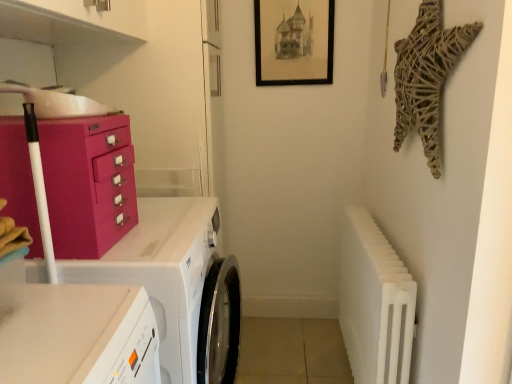
Where is `unoccupied region to the right of matte pink cabinet at left`? Image resolution: width=512 pixels, height=384 pixels. unoccupied region to the right of matte pink cabinet at left is located at coordinates (160, 237).